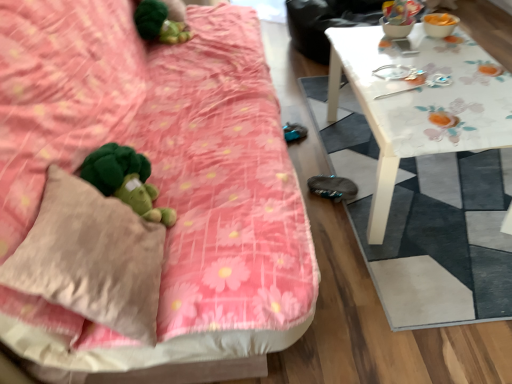
Identify the location of vacant space situated above white glossy table at upper right (from a real-world perspective). point(417,64).